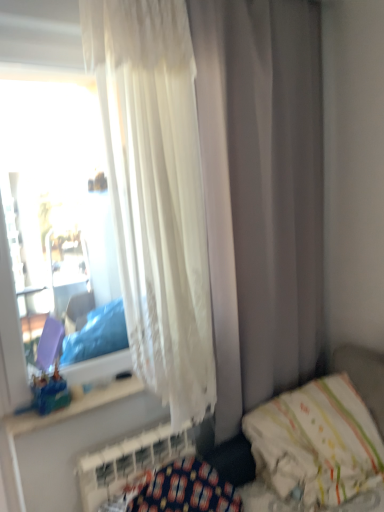
Question: Can you confirm if white textured radiator at lower left is taller than white sheer curtain at upper left?

Choices:
 (A) yes
 (B) no

Answer: (B)

Question: Can you confirm if white textured radiator at lower left is smaller than white sheer curtain at upper left?

Choices:
 (A) yes
 (B) no

Answer: (A)

Question: Considering the relative sizes of white textured radiator at lower left and white sheer curtain at upper left in the image provided, is white textured radiator at lower left thinner than white sheer curtain at upper left?

Choices:
 (A) yes
 (B) no

Answer: (A)

Question: Is the position of white textured radiator at lower left more distant than that of white sheer curtain at upper left?

Choices:
 (A) no
 (B) yes

Answer: (B)

Question: Are white textured radiator at lower left and white sheer curtain at upper left located far from each other?

Choices:
 (A) yes
 (B) no

Answer: (B)

Question: Is white textured radiator at lower left facing away from white sheer curtain at upper left?

Choices:
 (A) yes
 (B) no

Answer: (B)

Question: Is white fabric hospital bed at lower right oriented away from translucent plastic toy at window?

Choices:
 (A) yes
 (B) no

Answer: (B)

Question: Are white fabric hospital bed at lower right and translucent plastic toy at window beside each other?

Choices:
 (A) no
 (B) yes

Answer: (A)

Question: Considering the relative positions of white fabric hospital bed at lower right and translucent plastic toy at window in the image provided, is white fabric hospital bed at lower right to the left of translucent plastic toy at window from the viewer's perspective?

Choices:
 (A) yes
 (B) no

Answer: (B)

Question: Is white fabric hospital bed at lower right positioned in front of translucent plastic toy at window?

Choices:
 (A) no
 (B) yes

Answer: (B)

Question: Considering the relative sizes of white fabric hospital bed at lower right and translucent plastic toy at window in the image provided, is white fabric hospital bed at lower right bigger than translucent plastic toy at window?

Choices:
 (A) no
 (B) yes

Answer: (B)

Question: Does white fabric hospital bed at lower right have a greater width compared to translucent plastic toy at window?

Choices:
 (A) no
 (B) yes

Answer: (B)

Question: Can you confirm if white textured radiator at lower left is taller than white fabric hospital bed at lower right?

Choices:
 (A) yes
 (B) no

Answer: (B)